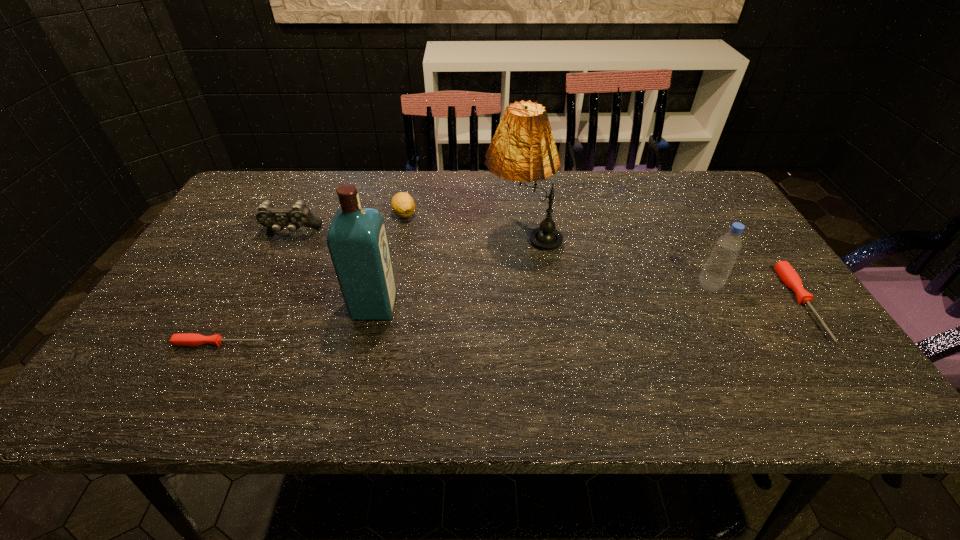
To achieve uniform spacing by inserting another screwdriver among them, please point to a free space for this new screwdriver. Please provide its 2D coordinates. Your answer should be formatted as a tuple, i.e. [(x, y)], where the tuple contains the x and y coordinates of a point satisfying the conditions above.

[(524, 323)]